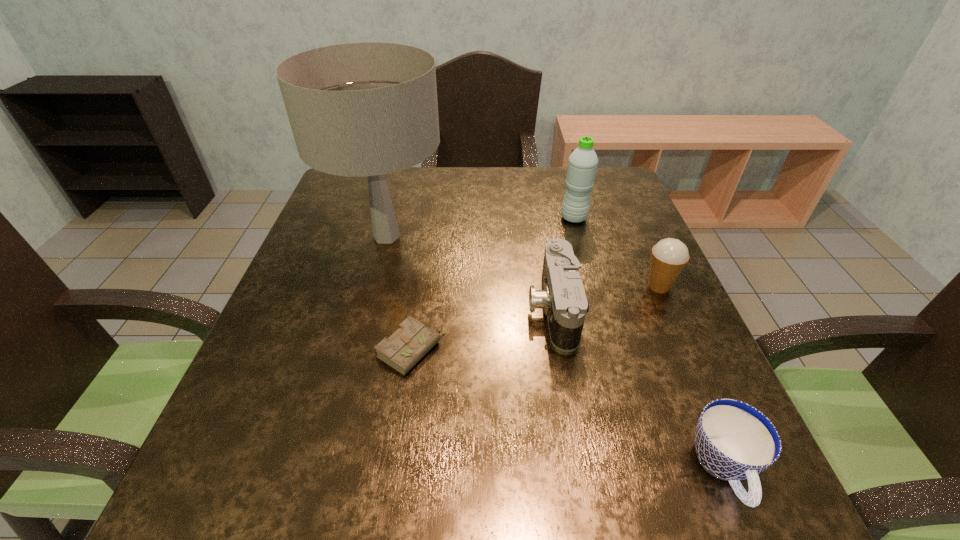
You are a GUI agent. You are given a task and a screenshot of the screen. Output one action in this format:
    pyautogui.click(x=<x>, y=<y>)
    Task: Click on the lampshade
    This screenshot has width=960, height=540.
    Given the screenshot: What is the action you would take?
    pyautogui.click(x=367, y=109)

Where is `the fifth shortest object`? the fifth shortest object is located at coordinates (582, 165).

Image resolution: width=960 pixels, height=540 pixels. In order to click on the third object from right to left in this screenshot , I will do [x=582, y=165].

At what (x,y) coordinates should I click in order to perform the action: click on icecream. Please return your answer as a coordinate pair (x, y). Looking at the image, I should click on (669, 256).

Image resolution: width=960 pixels, height=540 pixels. I want to click on the fourth tallest object, so click(x=563, y=298).

Identify the location of camera. (563, 298).

The height and width of the screenshot is (540, 960). What are the coordinates of `the nearest object` in the screenshot? It's located at (734, 441).

The width and height of the screenshot is (960, 540). Identify the location of cup. (734, 441).

Where is `diary`? This screenshot has height=540, width=960. diary is located at coordinates (410, 343).

Locate an element on the screen. free space located on the front-facing side of the tallest object is located at coordinates (513, 236).